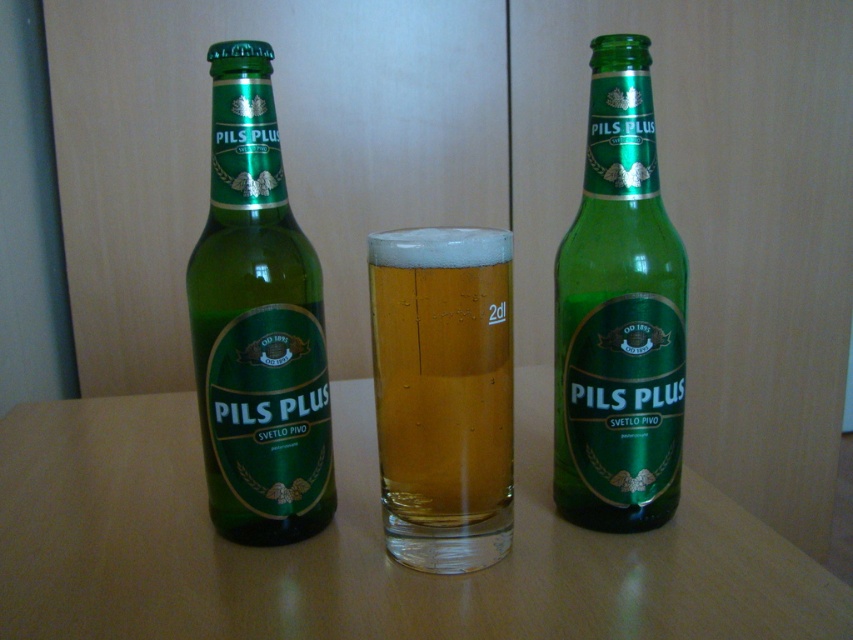
Looking at this image, you are a photographer trying to capture the glass of beer in the center. You notice two points marked in the image. One is at point (283, 305) and the other at point (450, 445). Which point should you focus on to ensure the glass is in sharp focus?

Point (283, 305) is further to the camera than point (450, 445). To ensure the glass in the center is in sharp focus, you should focus on point (283, 305) since it is closer to the camera and part of the glass.

You are a bartender trying to place a new glass between the two points labeled as point (657, 410) and point (465, 493). Can you determine if there is enough space between them to place the glass?

Point (657, 410) is behind point (465, 493), so placing a glass between them would not be possible as they are not aligned in the same plane.

You are a bartender who needs to reach for the green glass bottle at center and the translucent glass at center. Which one will you grab first if you are approaching from the front?

You will grab the green glass bottle at center first because it is closer to you than the translucent glass at center, which is further away.